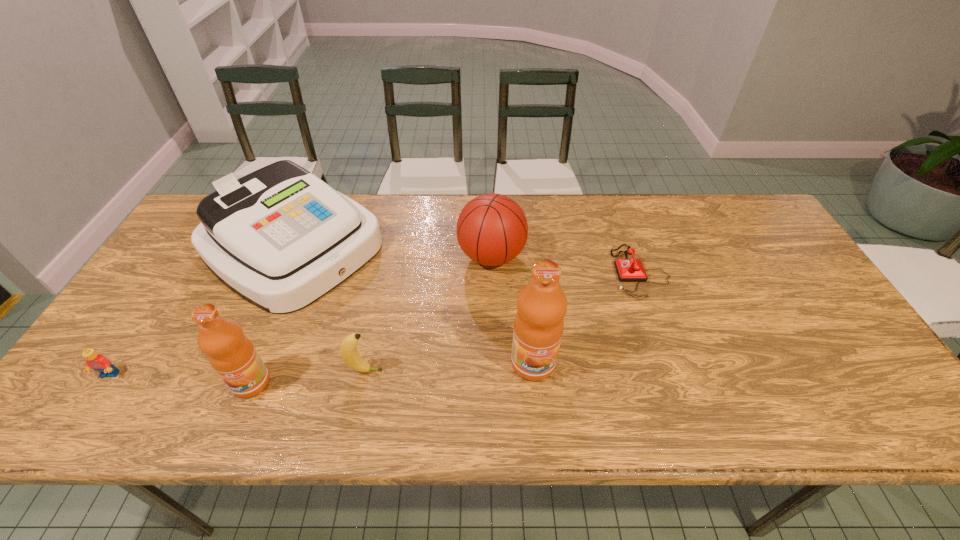
The width and height of the screenshot is (960, 540). In order to click on vacant area situated on the right of the cash register in this screenshot , I will do `click(412, 247)`.

The image size is (960, 540). I want to click on free region located 0.050m on the dial of the rightmost object, so click(595, 272).

I want to click on vacant space situated on the dial of the rightmost object, so click(x=521, y=272).

At what (x,y) coordinates should I click in order to perform the action: click on vacant space located 0.360m on the dial of the rightmost object. Please return your answer as a coordinate pair (x, y). Looking at the image, I should click on (486, 272).

Identify the location of vacant space situated on the right of the basketball. (644, 256).

The width and height of the screenshot is (960, 540). I want to click on free space located from the stem of the banana, so click(x=541, y=371).

Where is `cash register located in the far edge section of the desktop`? cash register located in the far edge section of the desktop is located at coordinates (280, 238).

At what (x,y) coordinates should I click in order to perform the action: click on basketball located in the far edge section of the desktop. Please return your answer as a coordinate pair (x, y). Looking at the image, I should click on (492, 229).

This screenshot has width=960, height=540. Find the location of `Lego present at the near edge`. Lego present at the near edge is located at coordinates (98, 362).

At what (x,y) coordinates should I click in order to perform the action: click on banana that is positioned at the near edge. Please return your answer as a coordinate pair (x, y). The width and height of the screenshot is (960, 540). Looking at the image, I should click on (348, 349).